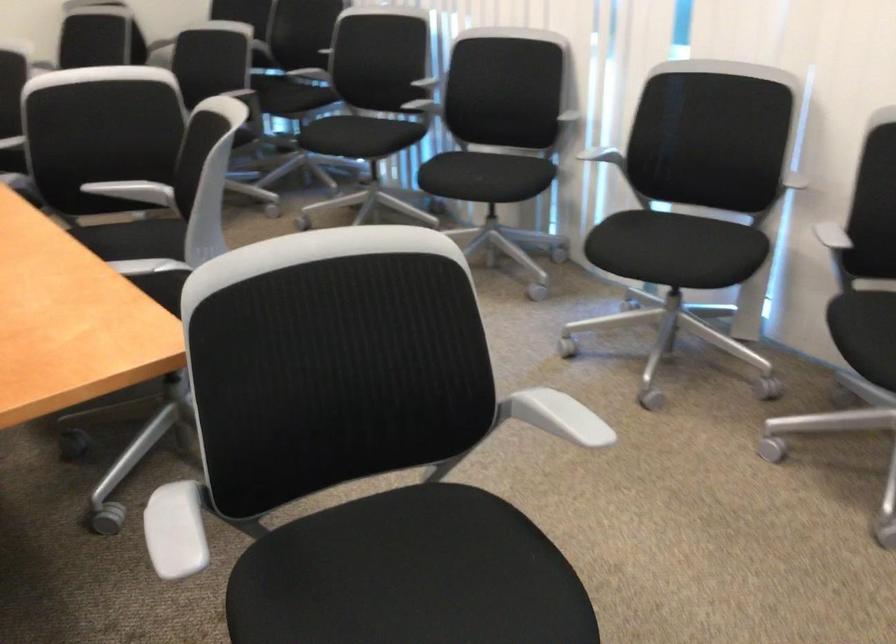
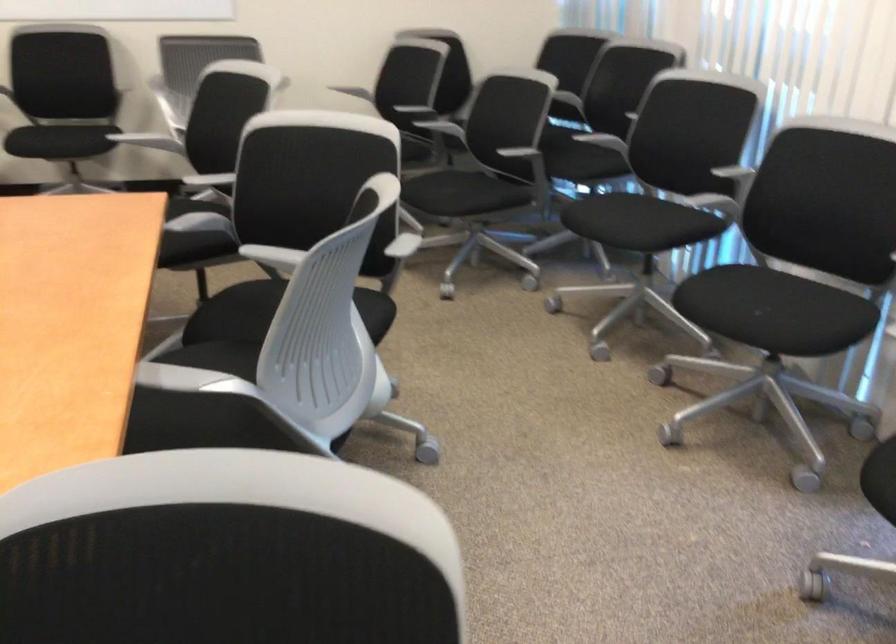
Find the pixel in the second image that matches (492,176) in the first image.

(771, 310)